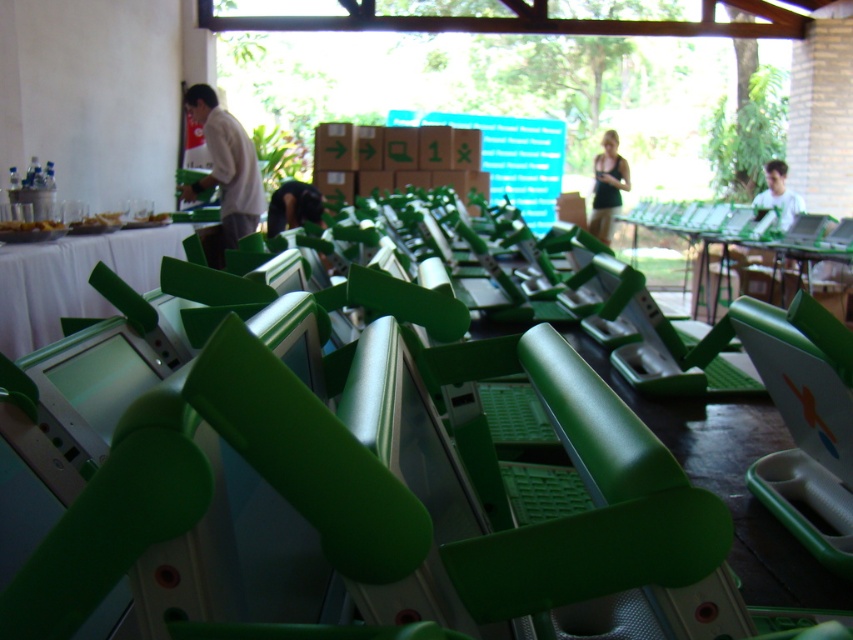
Is green plastic folding chair at center wider than black fabric shirt at center?

No, green plastic folding chair at center is not wider than black fabric shirt at center.

Who is more distant from viewer, (480, 580) or (608, 180)?

Positioned behind is point (608, 180).

Identify the location of green plastic folding chair at center. (506, 529).

Which is in front, point (590, 225) or point (772, 188)?

Positioned in front is point (772, 188).

From the picture: Is black fabric shirt at center above green plastic laptop at upper right?

Yes.

Image resolution: width=853 pixels, height=640 pixels. I want to click on black fabric shirt at center, so click(607, 186).

Find the location of a particular element. This screenshot has height=640, width=853. black fabric shirt at center is located at coordinates (607, 186).

Is green plastic folding chair at center to the right of green plastic table at center from the viewer's perspective?

Indeed, green plastic folding chair at center is positioned on the right side of green plastic table at center.

Does green plastic folding chair at center have a larger size compared to green plastic table at center?

Actually, green plastic folding chair at center might be smaller than green plastic table at center.

Locate an element on the screen. Image resolution: width=853 pixels, height=640 pixels. green plastic folding chair at center is located at coordinates (506, 529).